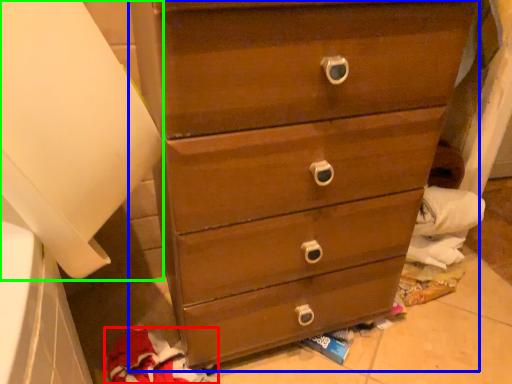
Question: Which object is positioned closest to clothing (highlighted by a red box)? Select from chest of drawers (highlighted by a blue box) and paper towel (highlighted by a green box).

Choices:
 (A) chest of drawers
 (B) paper towel

Answer: (A)